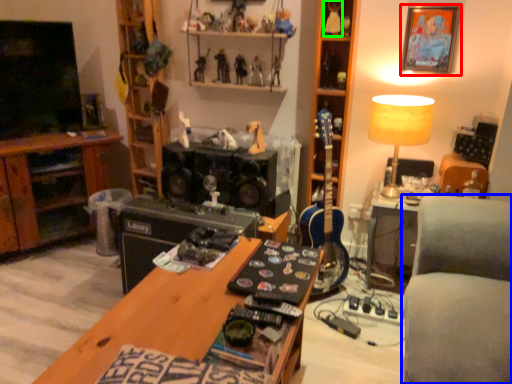
Question: Based on their relative distances, which object is farther from picture frame (highlighted by a red box)? Choose from studio couch (highlighted by a blue box) and toy (highlighted by a green box).

Choices:
 (A) studio couch
 (B) toy

Answer: (A)